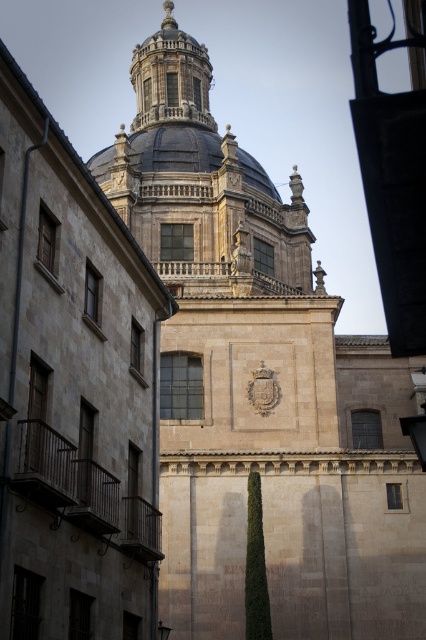
You are an architect examining the historic building. You notice the blue stone dome at center and the smooth gray dome at center. Which dome is closer to you?

The blue stone dome at center is closer to you because the smooth gray dome at center is behind it.

You are an architect assessing the structural integrity of the building. You notice two domes on the facade. Which dome, the blue stone dome at center or the smooth gray dome at center, has a greater surface area to accommodate more decorative elements?

The blue stone dome at center has a larger size than the smooth gray dome at center, so it has a greater surface area and can accommodate more decorative elements.